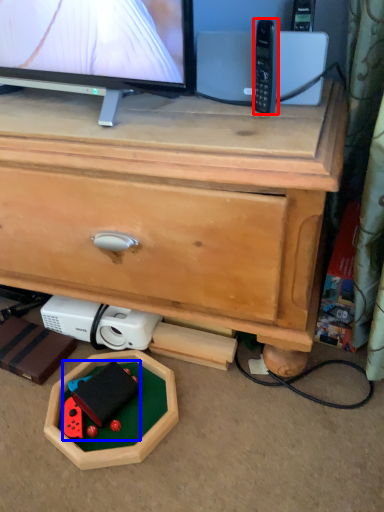
Question: Among these objects, which one is farthest to the camera, control (highlighted by a red box) or toy (highlighted by a blue box)?

Choices:
 (A) control
 (B) toy

Answer: (B)